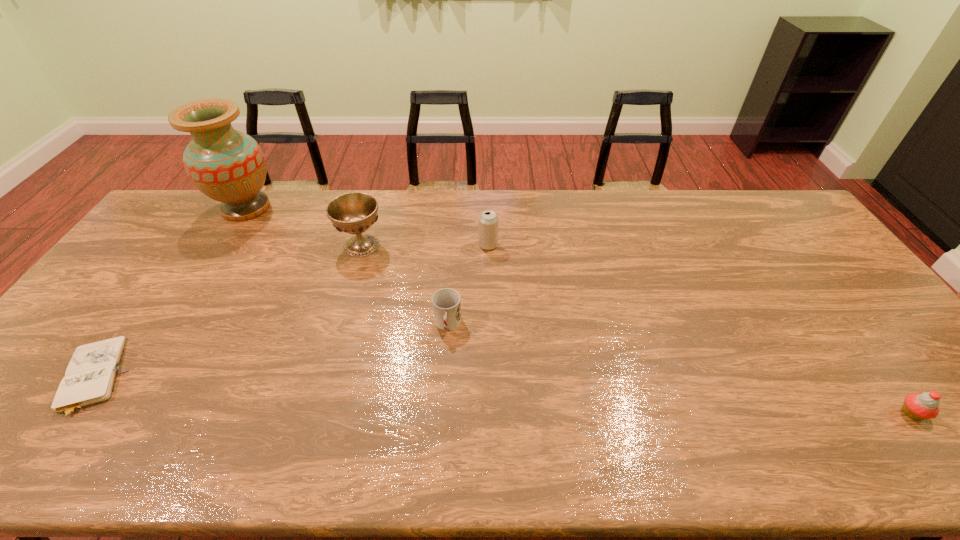
This screenshot has width=960, height=540. Find the location of `vacant space located on the left of the second tallest object`. vacant space located on the left of the second tallest object is located at coordinates (276, 246).

This screenshot has width=960, height=540. Identify the location of free location located 0.360m on the right of the second object from right to left. (609, 245).

Locate an element on the screen. vacant space located on the handle side of the cup is located at coordinates (445, 359).

You are a GUI agent. You are given a task and a screenshot of the screen. Output one action in this format:
    pyautogui.click(x=<x>, y=<y>)
    Task: Click on the vacant space situated on the right of the cupcake
    This screenshot has height=540, width=960.
    Given the screenshot: What is the action you would take?
    pyautogui.click(x=956, y=413)

I want to click on free space located on the right of the shortest object, so click(x=174, y=378).

Locate an element on the screen. object present at the far edge is located at coordinates (227, 165).

Where is `vase located at the left edge`? vase located at the left edge is located at coordinates (227, 165).

Identify the location of notebook at the left edge. (90, 377).

Where is `object that is positioned at the right edge`? The width and height of the screenshot is (960, 540). object that is positioned at the right edge is located at coordinates (919, 406).

Find the location of a particular element. The height and width of the screenshot is (540, 960). object present at the far left corner is located at coordinates (227, 165).